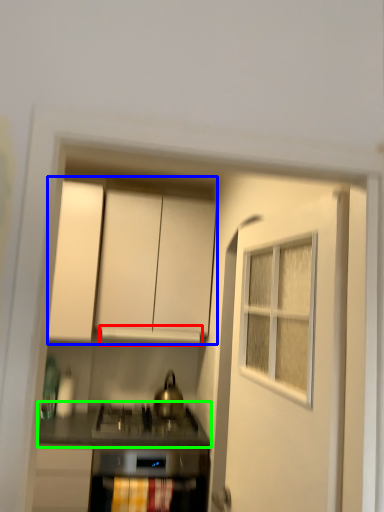
Question: Which object is positioned farthest from vent (highlighted by a red box)? Select from cabinetry (highlighted by a blue box) and countertop (highlighted by a green box).

Choices:
 (A) cabinetry
 (B) countertop

Answer: (B)